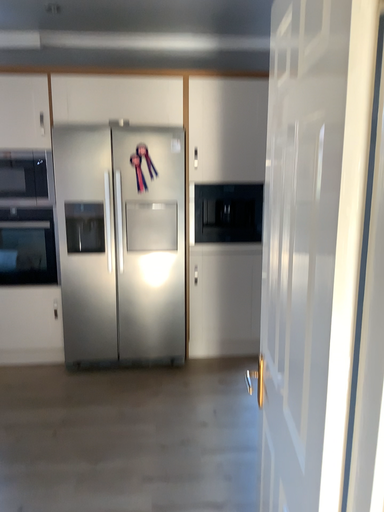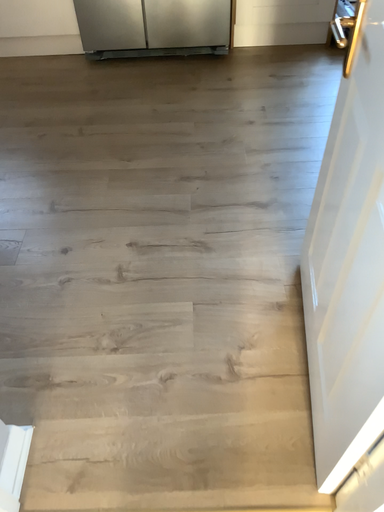
Question: How did the camera likely rotate when shooting the video?

Choices:
 (A) rotated upward
 (B) rotated downward

Answer: (B)